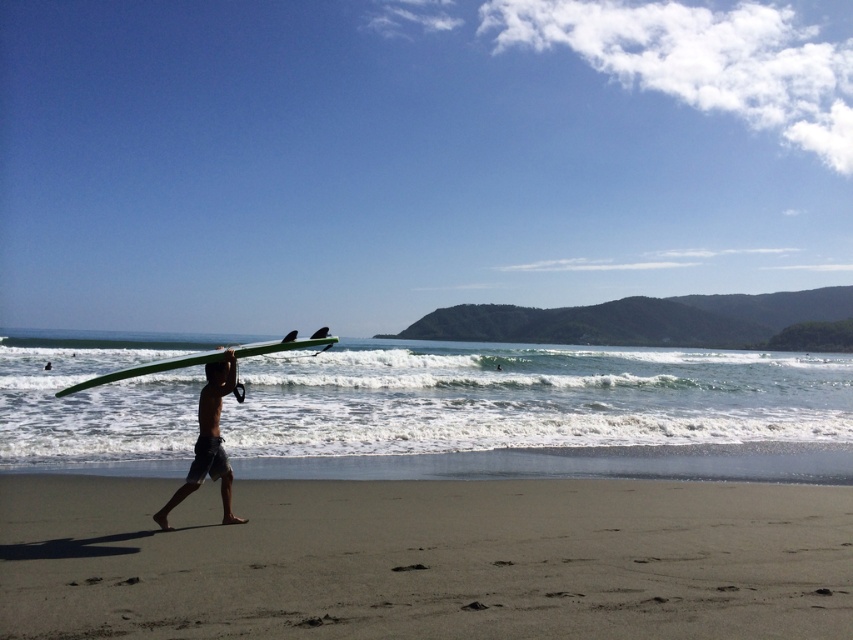
Question: Can you confirm if shiny green surfboard at center is positioned below matte black surfboard at center?

Choices:
 (A) yes
 (B) no

Answer: (A)

Question: Which point is farther from the camera taking this photo?

Choices:
 (A) (325, 333)
 (B) (305, 582)
 (C) (210, 381)

Answer: (A)

Question: Observing the image, what is the correct spatial positioning of smooth golden sand at lower center in reference to matte black surfboard at center?

Choices:
 (A) below
 (B) above

Answer: (A)

Question: Can you confirm if smooth golden sand at lower center is positioned above shiny green surfboard at center?

Choices:
 (A) yes
 (B) no

Answer: (B)

Question: Among these objects, which one is farthest from the camera?

Choices:
 (A) green matte surfboard at center
 (B) matte black surfboard at center

Answer: (B)

Question: Estimate the real-world distances between objects in this image. Which object is farther from the shiny green surfboard at center?

Choices:
 (A) matte black surfboard at center
 (B) smooth golden sand at lower center

Answer: (B)